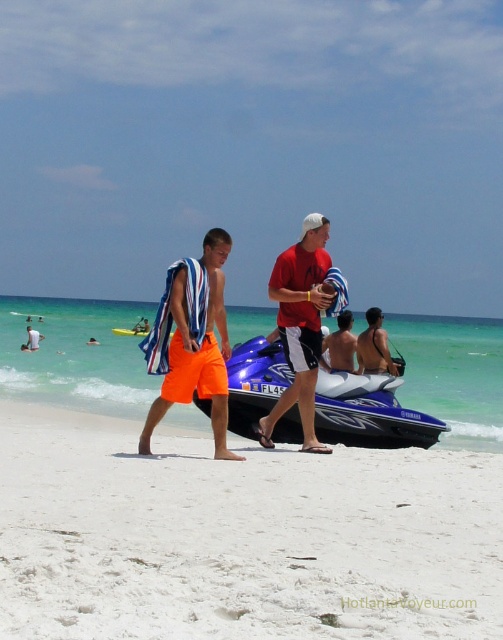
Question: Which of the following is the farthest from the observer?

Choices:
 (A) orange cotton shorts at center
 (B) orange fabric towel at lower left
 (C) red matte shirt at center
 (D) metallic blue snowmobile at center

Answer: (B)

Question: Is metallic blue snowmobile at center further to the viewer compared to red matte shirt at center?

Choices:
 (A) no
 (B) yes

Answer: (B)

Question: Considering the real-world distances, which object is farthest from the smooth tan skin at center?

Choices:
 (A) metallic blue snowmobile at center
 (B) white sandy beach at lower center

Answer: (B)

Question: Does metallic blue snowmobile at center have a lesser width compared to orange fabric towel at lower left?

Choices:
 (A) no
 (B) yes

Answer: (B)

Question: Which of the following is the farthest from the observer?

Choices:
 (A) (370, 348)
 (B) (228, 461)

Answer: (A)

Question: Is smooth tan skin at center above blue glossy jet ski at center?

Choices:
 (A) yes
 (B) no

Answer: (B)